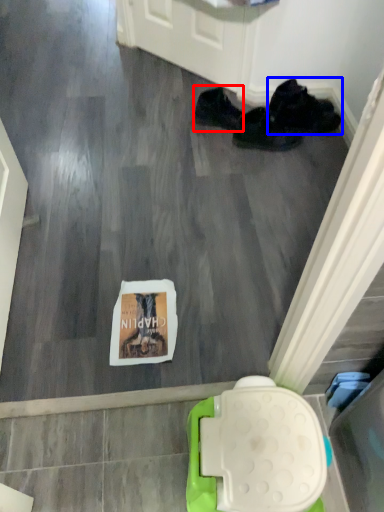
Question: Which point is further to the camera, footwear (highlighted by a red box) or footwear (highlighted by a blue box)?

Choices:
 (A) footwear
 (B) footwear

Answer: (B)